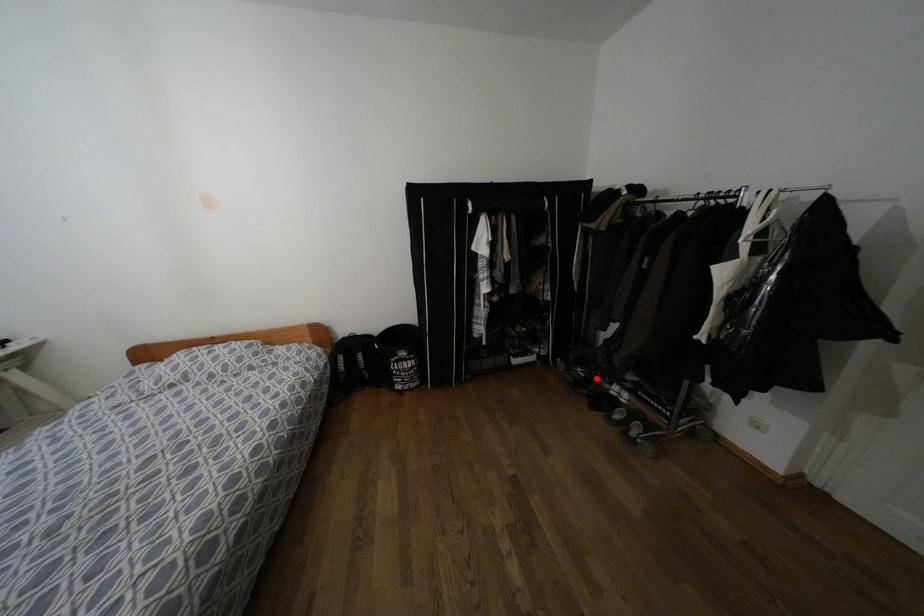
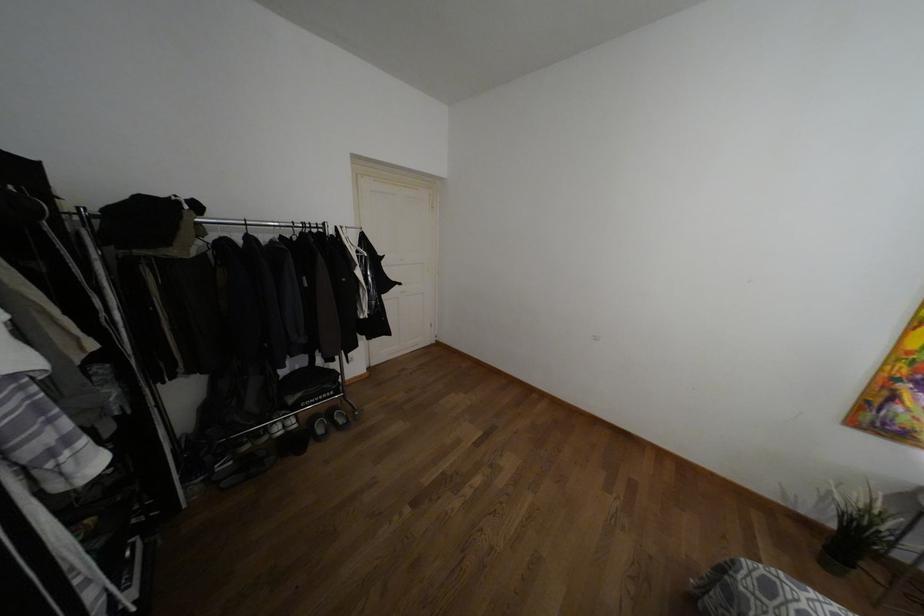
The point at the highlighted location is marked in the first image. Where is the corresponding point in the second image?

(246, 447)